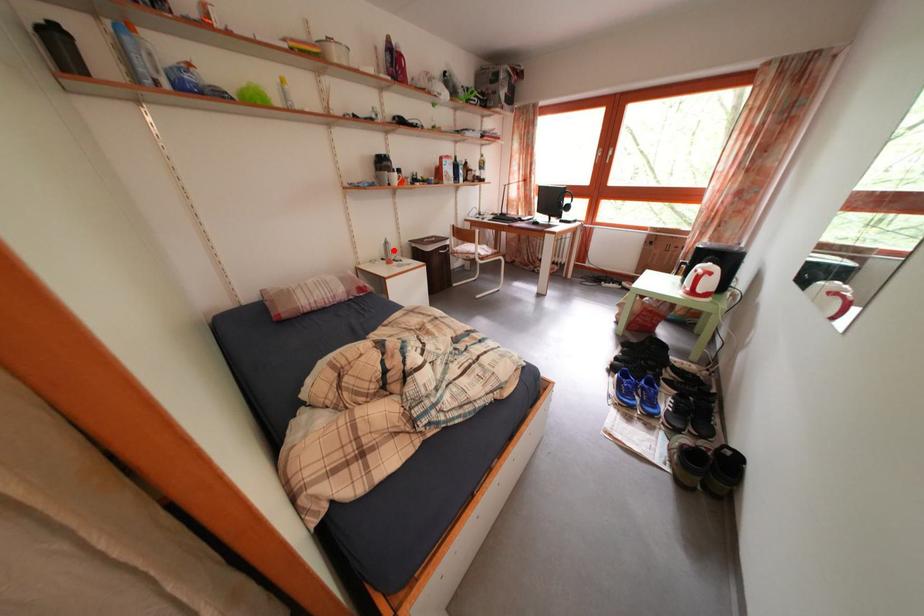
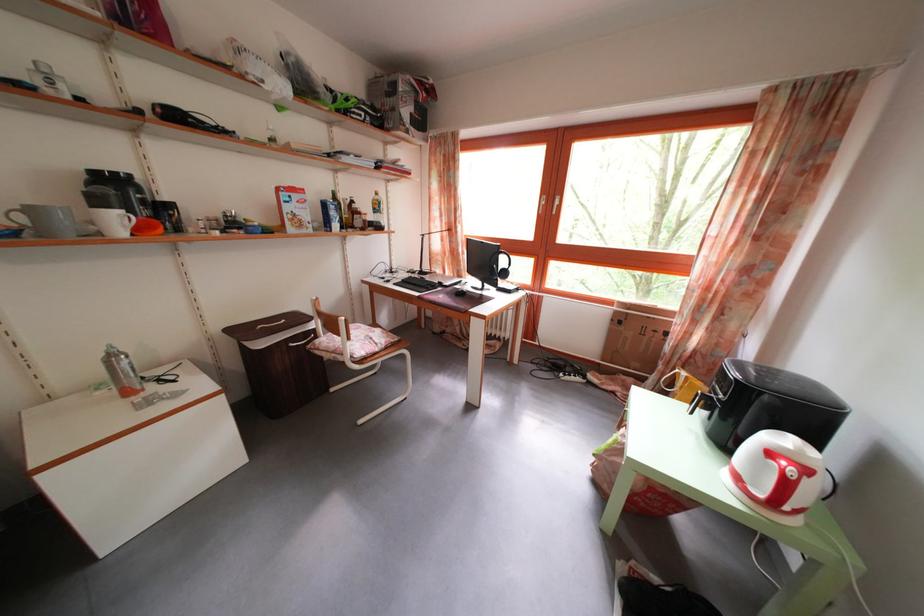
Question: I am providing you with two images of the same scene from different viewpoints. Image1 has a red point marked. In image2, the corresponding 3D location appears at what relative position? Reply with the corresponding letter.

Choices:
 (A) Closer
 (B) Farther

Answer: (B)